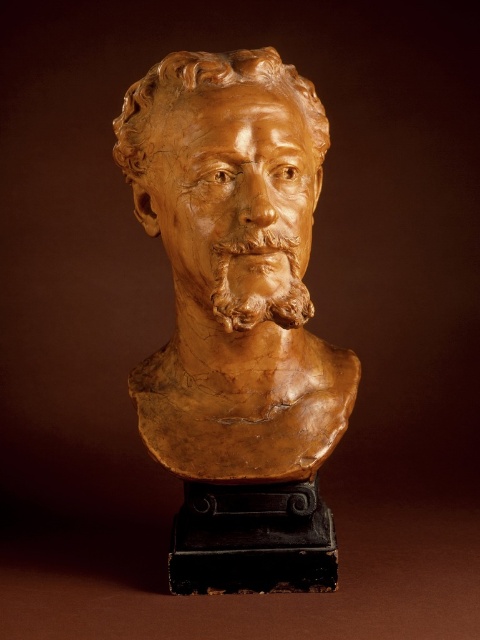
Is matte clay bust at center bigger than brown clay bust at center?

Correct, matte clay bust at center is larger in size than brown clay bust at center.

Is matte clay bust at center in front of brown clay bust at center?

Yes, matte clay bust at center is in front of brown clay bust at center.

Where is `matte clay bust at center`? This screenshot has height=640, width=480. matte clay bust at center is located at coordinates (x=238, y=317).